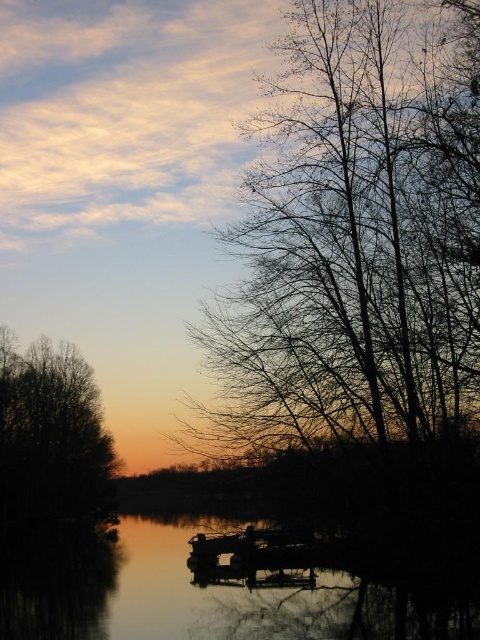
Question: Which of the following is the closest to the observer?

Choices:
 (A) pyautogui.click(x=101, y=452)
 (B) pyautogui.click(x=439, y=589)

Answer: (B)

Question: Among these objects, which one is farthest from the camera?

Choices:
 (A) brown leafless tree at left
 (B) silhouette bare branches at right
 (C) silky smooth water at center

Answer: (A)

Question: Considering the relative positions of silhouette bare branches at right and silky smooth water at center in the image provided, where is silhouette bare branches at right located with respect to silky smooth water at center?

Choices:
 (A) above
 (B) below

Answer: (A)

Question: Based on their relative distances, which object is farther from the silky smooth water at center?

Choices:
 (A) brown leafless tree at left
 (B) silhouette bare branches at right

Answer: (A)

Question: Can you confirm if silky smooth water at center is positioned to the left of brown leafless tree at left?

Choices:
 (A) no
 (B) yes

Answer: (A)

Question: Can you confirm if silhouette bare branches at right is positioned above brown leafless tree at left?

Choices:
 (A) no
 (B) yes

Answer: (B)